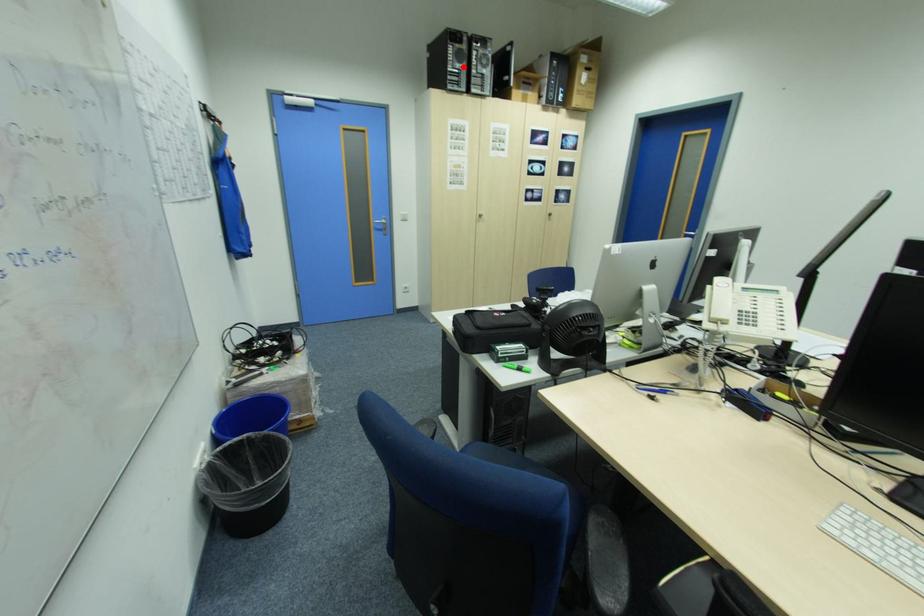
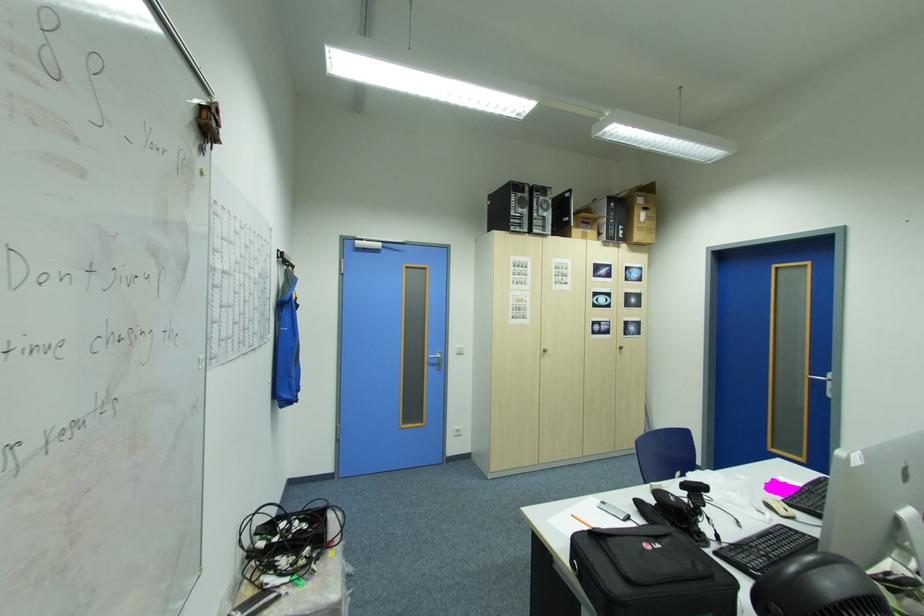
Where in the second image is the point corresponding to the highlighted location from the first image?

(527, 212)